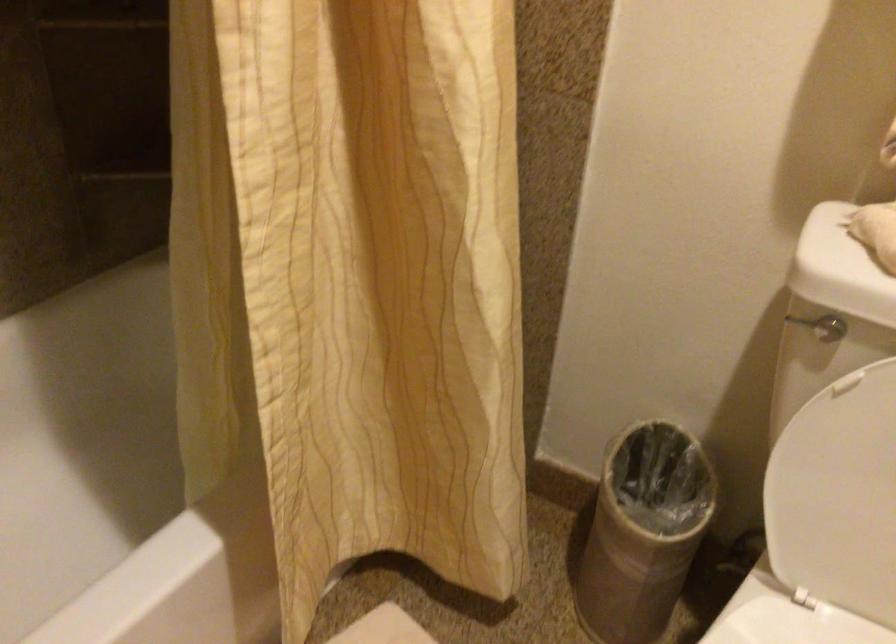
Where is `white toilet lid`? Image resolution: width=896 pixels, height=644 pixels. white toilet lid is located at coordinates (834, 480).